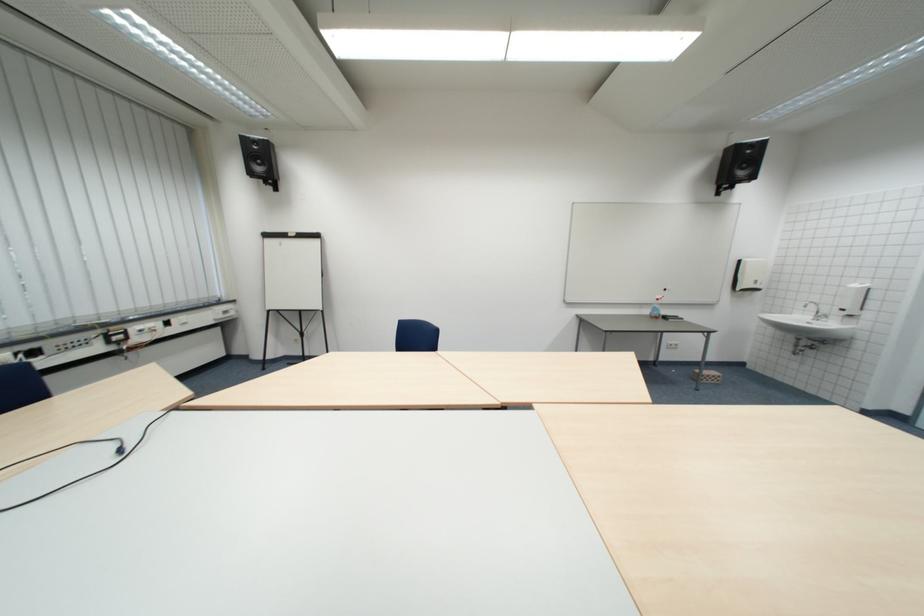
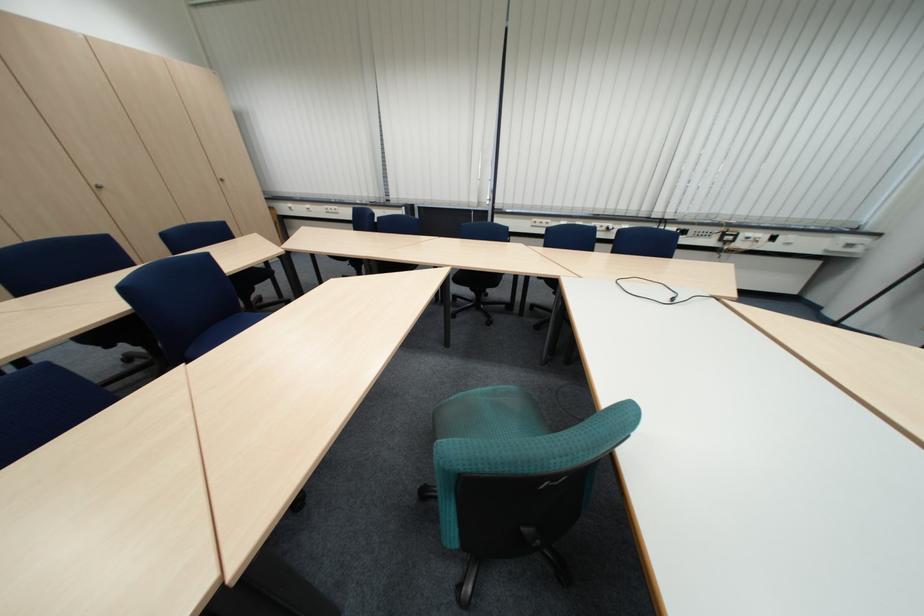
Find the pixel in the second image that matches point 134,453 in the first image.

(687, 301)